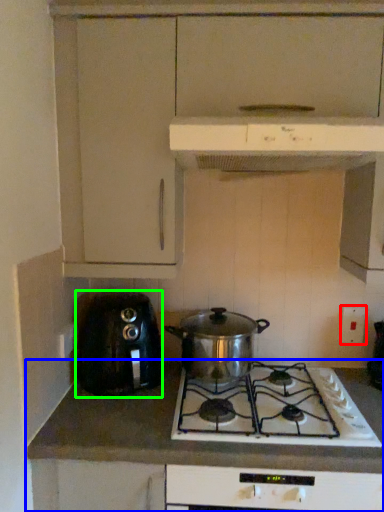
Question: Estimate the real-world distances between objects in this image. Which object is farther from electric outlet (highlighted by a red box), countertop (highlighted by a blue box) or toaster (highlighted by a green box)?

Choices:
 (A) countertop
 (B) toaster

Answer: (B)